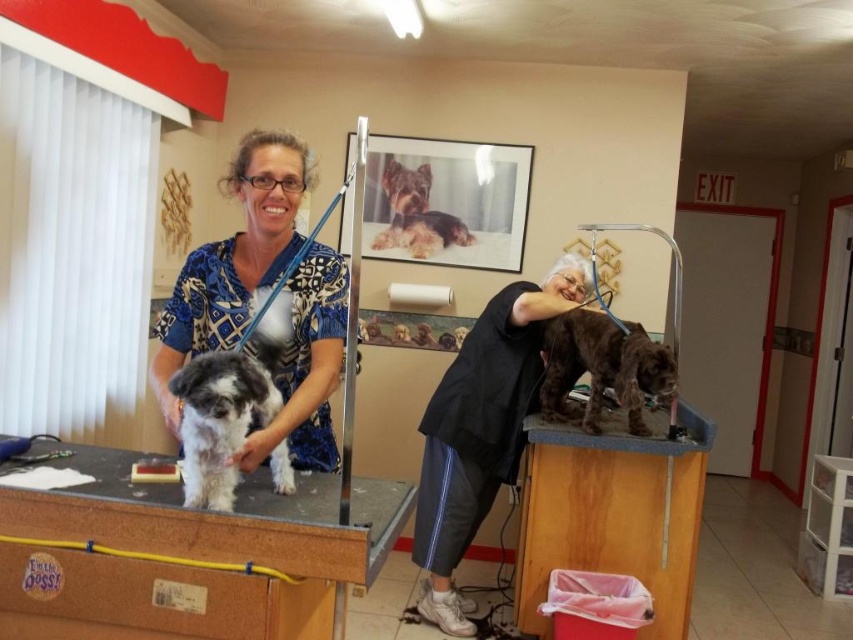
Is wooden table at center wider than blue printed scrubs at left?

Correct, the width of wooden table at center exceeds that of blue printed scrubs at left.

Is wooden table at center further to the viewer compared to blue printed scrubs at left?

No, wooden table at center is in front of blue printed scrubs at left.

Who is more forward, (316, 634) or (302, 304)?

Positioned in front is point (302, 304).

Find the location of `wooden table at center`. wooden table at center is located at coordinates (219, 522).

Is point (647, 346) positioned in front of point (380, 236)?

Yes, it is.

At what (x,y) coordinates should I click in order to perform the action: click on shiny brown fur at center. Please return your answer as a coordinate pair (x, y). The height and width of the screenshot is (640, 853). Looking at the image, I should click on (602, 368).

Does point (576, 474) come behind point (183, 474)?

Yes.

Is wooden table at lower right above fluffy white fur at center?

No, wooden table at lower right is not above fluffy white fur at center.

Is point (648, 456) positioned before point (236, 412)?

That is False.

Locate an element on the screen. The image size is (853, 640). wooden table at lower right is located at coordinates (612, 513).